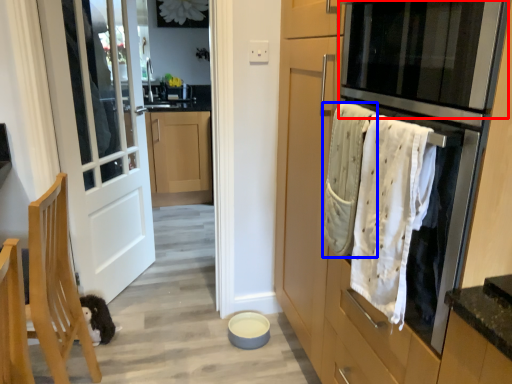
Question: Which of the following is the closest to the observer, oven (highlighted by a red box) or bath towel (highlighted by a blue box)?

Choices:
 (A) oven
 (B) bath towel

Answer: (A)